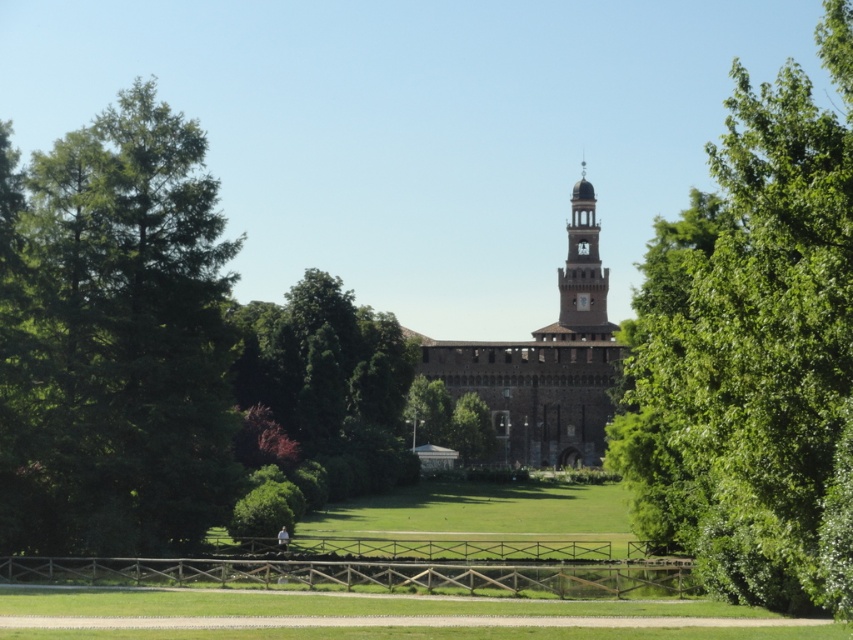
You are planning to plant a new tree in the park. The green leafy tree at left is currently occupying a smaller area compared to the brown stone tower at center. If you want to plant a tree that requires more space, which existing tree should you consider removing?

The green leafy tree at left occupies less space than the brown stone tower at center, so you should consider removing the green leafy tree at left to make space for the new tree that requires more space.

You are a gardener planning to plant a new tree in the park. The green leafy tree at left and the smooth stone bell tower at center are both in your line of sight. Which object is bigger in size?

The green leafy tree at left is larger in size than the smooth stone bell tower at center.